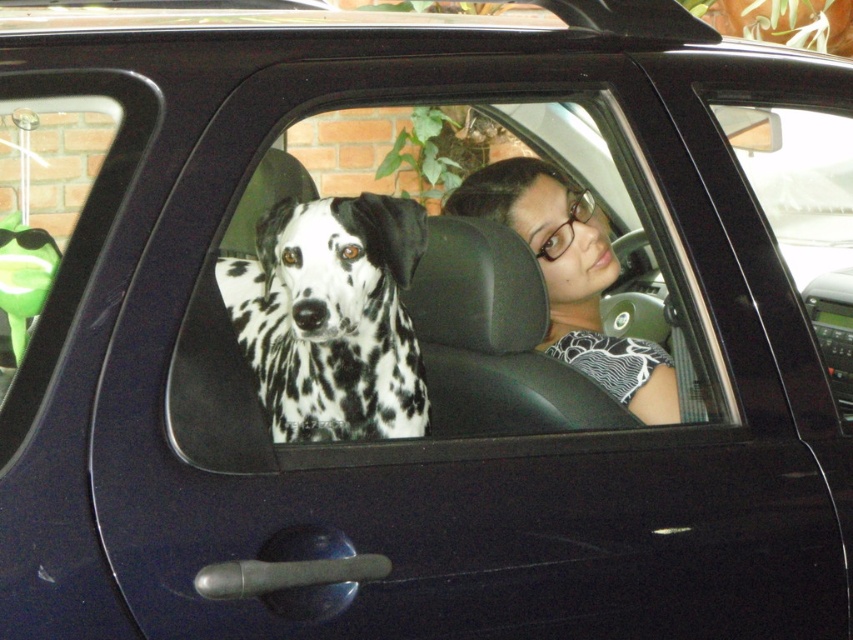
In the scene shown: What are the coordinates of the black leather car window at center?

The black leather car window at center is located at coordinates point (425, 365).

You are standing outside the car looking in through the driver side window. There is a point at center labeled point (425,365). Is that point located on the black leather car window?

Yes, the point at (425,365) is located on the black leather car window at center as described.

You are a delivery robot with a 20 inch wide package. You need to place this package between the black and white spotted dog at center and the matte black shirt at center in the car. Can you fit the package between them?

The black and white spotted dog at center and the matte black shirt at center are 21.33 inches apart. Since the package is 20 inches wide, it can fit between them with 1.33 inches of space remaining.